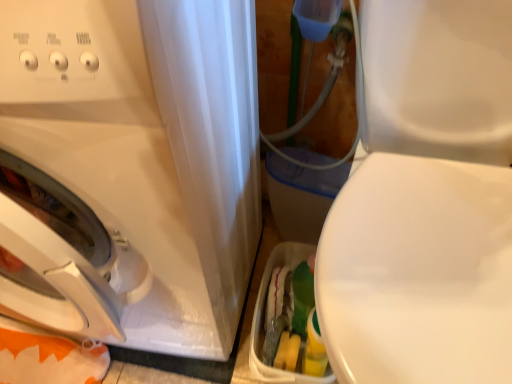
Identify the location of white glossy toilet at right. (426, 202).

The image size is (512, 384). Describe the element at coordinates (426, 202) in the screenshot. I see `white glossy toilet at right` at that location.

The image size is (512, 384). What do you see at coordinates (132, 169) in the screenshot? I see `white glossy washing machine at left` at bounding box center [132, 169].

Where is `white glossy washing machine at left`? white glossy washing machine at left is located at coordinates (132, 169).

The width and height of the screenshot is (512, 384). Identify the location of white glossy toilet at right. (x=426, y=202).

Is white glossy washing machine at left to the right of white glossy toilet at right from the viewer's perspective?

In fact, white glossy washing machine at left is to the left of white glossy toilet at right.

Is white glossy washing machine at left in front of or behind white glossy toilet at right in the image?

Clearly, white glossy washing machine at left is behind white glossy toilet at right.

Does point (221, 92) come closer to viewer compared to point (496, 164)?

Yes, point (221, 92) is closer to viewer.

From the image's perspective, who appears lower, white glossy washing machine at left or white glossy toilet at right?

white glossy toilet at right appears lower in the image.

From a real-world perspective, is white glossy washing machine at left below white glossy toilet at right?

No.

Does white glossy washing machine at left have a greater width compared to white glossy toilet at right?

In fact, white glossy washing machine at left might be narrower than white glossy toilet at right.

Considering the sizes of objects white glossy washing machine at left and white glossy toilet at right in the image provided, who is taller, white glossy washing machine at left or white glossy toilet at right?

white glossy washing machine at left.

Considering the sizes of objects white glossy washing machine at left and white glossy toilet at right in the image provided, who is bigger, white glossy washing machine at left or white glossy toilet at right?

With larger size is white glossy washing machine at left.

Is white glossy washing machine at left situated inside white glossy toilet at right or outside?

white glossy washing machine at left cannot be found inside white glossy toilet at right.

Is white glossy washing machine at left next to white glossy toilet at right?

No, white glossy washing machine at left is not making contact with white glossy toilet at right.

Is white glossy washing machine at left looking in the opposite direction of white glossy toilet at right?

That's not correct — white glossy washing machine at left is not looking away from white glossy toilet at right.

Locate an element on the screen. machine in front of the white glossy washing machine at left is located at coordinates (426, 202).

Visually, is white glossy toilet at right positioned to the left or to the right of white glossy washing machine at left?

In the image, white glossy toilet at right appears on the right side of white glossy washing machine at left.

Considering the positions of objects white glossy toilet at right and white glossy washing machine at left in the image provided, who is behind, white glossy toilet at right or white glossy washing machine at left?

Positioned behind is white glossy washing machine at left.

Is point (467, 116) closer or farther from the camera than point (64, 176)?

Point (467, 116) appears to be farther away from the viewer than point (64, 176).

From the image's perspective, is white glossy toilet at right above white glossy washing machine at left?

No.

From the picture: From a real-world perspective, is white glossy toilet at right physically below white glossy washing machine at left?

A: Correct, in the physical world, white glossy toilet at right is lower than white glossy washing machine at left.

Is white glossy toilet at right wider or thinner than white glossy washing machine at left?

Clearly, white glossy toilet at right has more width compared to white glossy washing machine at left.

In terms of height, does white glossy toilet at right look taller or shorter compared to white glossy washing machine at left?

Considering their sizes, white glossy toilet at right has less height than white glossy washing machine at left.

Between white glossy toilet at right and white glossy washing machine at left, which one has larger size?

white glossy washing machine at left is bigger.

Is white glossy toilet at right not inside white glossy washing machine at left?

Yes, white glossy toilet at right is outside of white glossy washing machine at left.

Is white glossy toilet at right in contact with white glossy washing machine at left?

There is a gap between white glossy toilet at right and white glossy washing machine at left.

Is white glossy toilet at right facing towards white glossy washing machine at left?

No, white glossy toilet at right is not facing towards white glossy washing machine at left.

Looking at this image, how many degrees apart are the facing directions of white glossy toilet at right and white glossy washing machine at left?

3.49 degrees separate the facing orientations of white glossy toilet at right and white glossy washing machine at left.

Where is `machine lying on the right of white glossy washing machine at left`? This screenshot has height=384, width=512. machine lying on the right of white glossy washing machine at left is located at coordinates (426, 202).

This screenshot has width=512, height=384. What are the coordinates of `machine in front of the white glossy washing machine at left` in the screenshot? It's located at (426, 202).

Identify the location of washing machine behind the white glossy toilet at right. (132, 169).